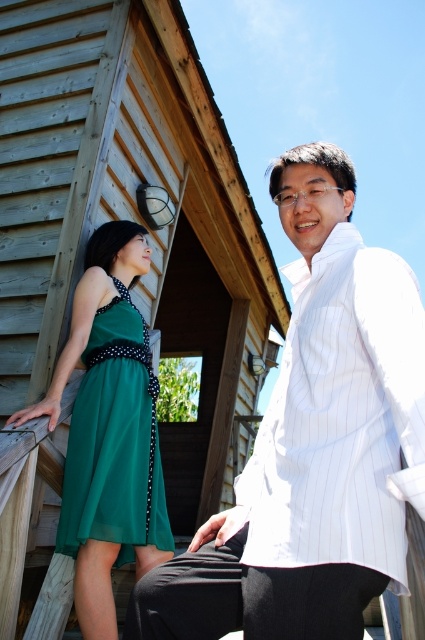
Which is in front, point (391, 333) or point (61, 540)?

Point (391, 333)

Which is behind, point (370, 291) or point (136, 356)?

Point (136, 356)

Where is `white striped shirt at right`? The width and height of the screenshot is (425, 640). white striped shirt at right is located at coordinates (311, 442).

Which of these two, wooden hut at upper left or green chiffon dress at left, stands shorter?

With less height is wooden hut at upper left.

Image resolution: width=425 pixels, height=640 pixels. What do you see at coordinates (130, 214) in the screenshot?
I see `wooden hut at upper left` at bounding box center [130, 214].

I want to click on wooden hut at upper left, so [130, 214].

Is wooden hut at upper left positioned in front of white striped shirt at right?

No, wooden hut at upper left is behind white striped shirt at right.

At what (x,y) coordinates should I click in order to perform the action: click on wooden hut at upper left. Please return your answer as a coordinate pair (x, y). Looking at the image, I should click on (130, 214).